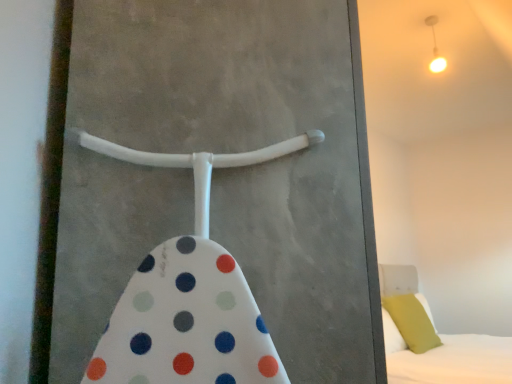
Question: Should I look upward or downward to see soft green pillow at right?

Choices:
 (A) down
 (B) up

Answer: (A)

Question: Is white plastic screen door at center facing towards matte white light fixture at upper right?

Choices:
 (A) no
 (B) yes

Answer: (A)

Question: Is white plastic screen door at center facing away from matte white light fixture at upper right?

Choices:
 (A) yes
 (B) no

Answer: (B)

Question: From the image's perspective, is white plastic screen door at center beneath matte white light fixture at upper right?

Choices:
 (A) no
 (B) yes

Answer: (B)

Question: Can you confirm if white plastic screen door at center is wider than matte white light fixture at upper right?

Choices:
 (A) no
 (B) yes

Answer: (B)

Question: Are white plastic screen door at center and matte white light fixture at upper right located far from each other?

Choices:
 (A) no
 (B) yes

Answer: (B)

Question: Is white plastic screen door at center beside matte white light fixture at upper right?

Choices:
 (A) yes
 (B) no

Answer: (B)

Question: Is matte white light fixture at upper right positioned in front of soft green pillow at right?

Choices:
 (A) no
 (B) yes

Answer: (B)

Question: Does matte white light fixture at upper right have a lesser width compared to soft green pillow at right?

Choices:
 (A) yes
 (B) no

Answer: (A)

Question: Does matte white light fixture at upper right have a smaller size compared to soft green pillow at right?

Choices:
 (A) no
 (B) yes

Answer: (B)

Question: From a real-world perspective, is matte white light fixture at upper right positioned under soft green pillow at right based on gravity?

Choices:
 (A) yes
 (B) no

Answer: (B)

Question: Is matte white light fixture at upper right not inside soft green pillow at right?

Choices:
 (A) no
 (B) yes

Answer: (B)

Question: Can you confirm if matte white light fixture at upper right is positioned to the right of soft green pillow at right?

Choices:
 (A) yes
 (B) no

Answer: (B)

Question: Considering the relative positions of matte white light fixture at upper right and white plastic screen door at center in the image provided, is matte white light fixture at upper right behind white plastic screen door at center?

Choices:
 (A) yes
 (B) no

Answer: (A)